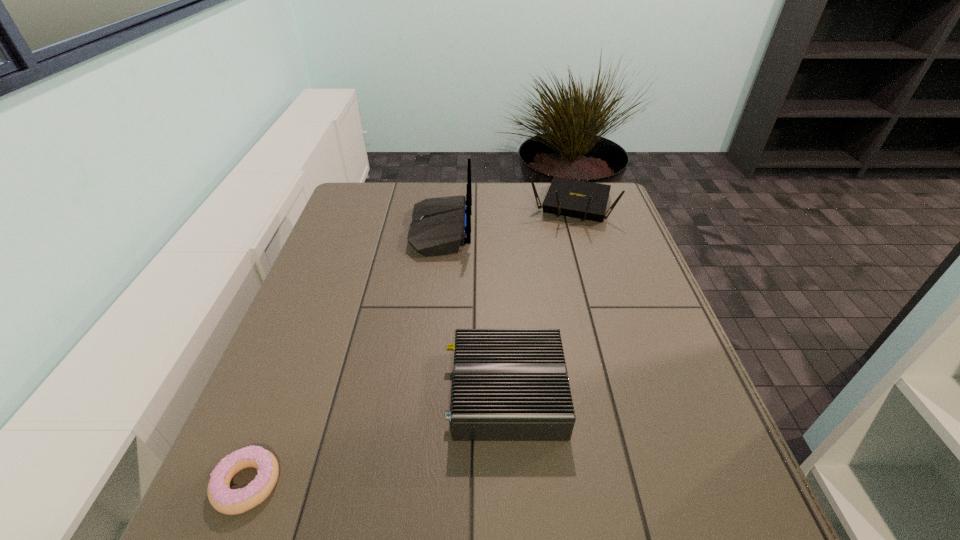
You are a GUI agent. You are given a task and a screenshot of the screen. Output one action in this format:
    pyautogui.click(x=<x>, y=<y>)
    Task: Click on the object that can be found as the closest to the shortest object
    
    Given the screenshot: What is the action you would take?
    pyautogui.click(x=508, y=384)

Locate which object is the second closest to the tallest router. Please provide its 2D coordinates. Your answer should be formatted as a tuple, i.e. [(x, y)], where the tuple contains the x and y coordinates of a point satisfying the conditions above.

[(508, 384)]

Locate which router is the closest to the second nearest object. Please provide its 2D coordinates. Your answer should be formatted as a tuple, i.e. [(x, y)], where the tuple contains the x and y coordinates of a point satisfying the conditions above.

[(439, 226)]

Identify which router is the second nearest to the shortest router. Please provide its 2D coordinates. Your answer should be formatted as a tuple, i.e. [(x, y)], where the tuple contains the x and y coordinates of a point satisfying the conditions above.

[(585, 200)]

Identify the location of free spot that satisfies the following two spatial constraints: 1. on the front side of the second tallest object; 2. on the back of the tallest router. The height and width of the screenshot is (540, 960). (578, 231).

You are a GUI agent. You are given a task and a screenshot of the screen. Output one action in this format:
    pyautogui.click(x=<x>, y=<y>)
    Task: Click on the free location that satisfies the following two spatial constraints: 1. on the back panel of the second shortest object; 2. on the front side of the nearest object
    This screenshot has height=540, width=960.
    Given the screenshot: What is the action you would take?
    pyautogui.click(x=512, y=484)

The width and height of the screenshot is (960, 540). Identify the location of blank area in the image that satisfies the following two spatial constraints: 1. on the front side of the second tallest object; 2. on the back panel of the nearest router. [x=625, y=393].

The image size is (960, 540). I want to click on vacant space that satisfies the following two spatial constraints: 1. on the back side of the leftmost object; 2. on the left side of the second tallest object, so click(x=356, y=206).

Identify the location of vacant area in the image that satisfies the following two spatial constraints: 1. on the back of the tallest object; 2. on the front side of the doughnut. (412, 484).